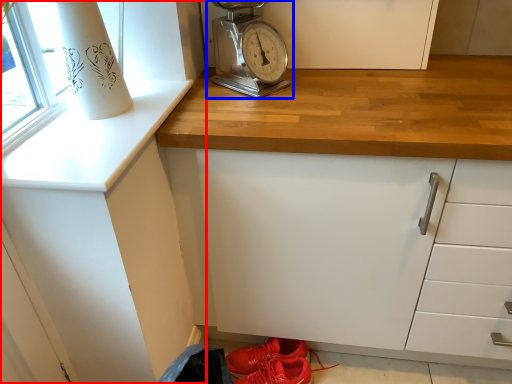
Question: Which point is further to the camera, cabinetry (highlighted by a red box) or home appliance (highlighted by a blue box)?

Choices:
 (A) cabinetry
 (B) home appliance

Answer: (B)